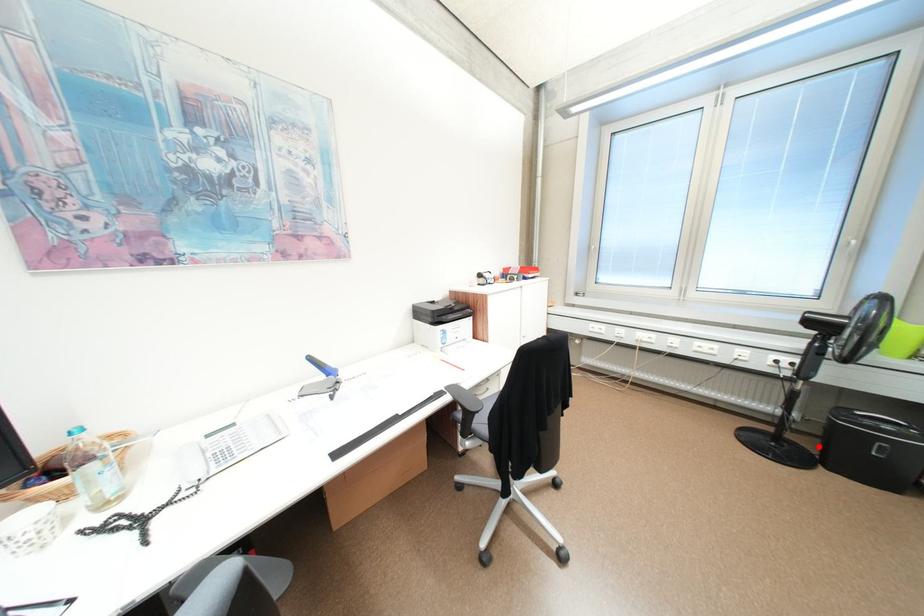
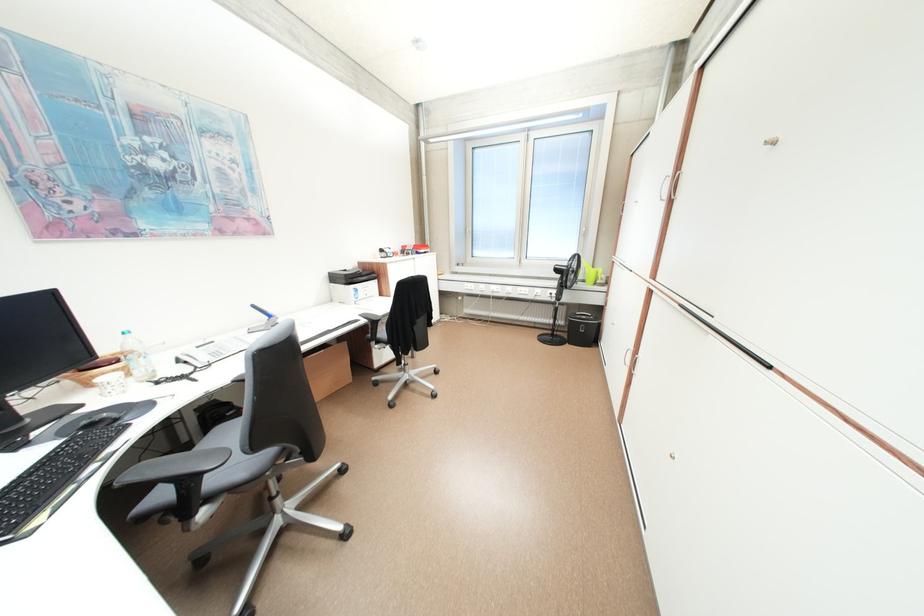
The point at the highlighted location is marked in the first image. Where is the corresponding point in the second image?

(576, 337)